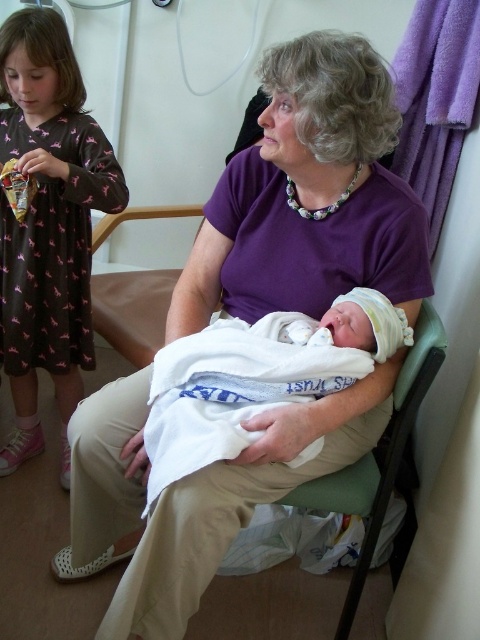
You are standing in the hospital room and want to give the young girl a gift. The young girl is wearing a brown cotton dress at left. Where should you walk to find the gift? The gift is placed at the point marked by coordinates (48,224).

The gift is located at the point marked by coordinates (48,224), which corresponds to the brown cotton dress at left. Therefore, you should walk towards the young girl wearing the brown cotton dress at left to deliver the gift.

You are a nurse in the hospital room and need to place a medical chart on the bed. The bed is covered by the white soft blanket at center. However, there is a brown cotton dress at left on the bed. Can you place the chart there without moving the dress?

The brown cotton dress at left is positioned over white soft blanket at center, so placing the chart there would require moving the dress to access the blanket underneath.